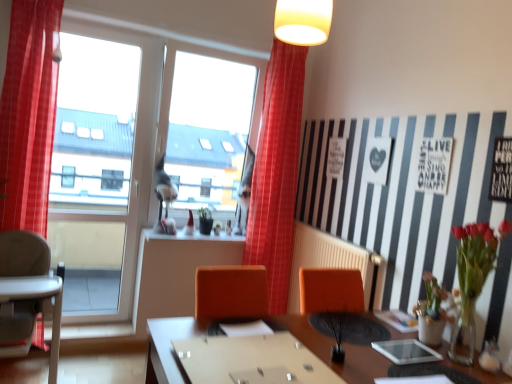
You are a GUI agent. You are given a task and a screenshot of the screen. Output one action in this format:
    pyautogui.click(x=<x>, y=<y>)
    Task: Click on the vacant space behind green matte plant at center, which ranks as the first plant in right-to-left order
    The width and height of the screenshot is (512, 384).
    Given the screenshot: What is the action you would take?
    pyautogui.click(x=332, y=344)